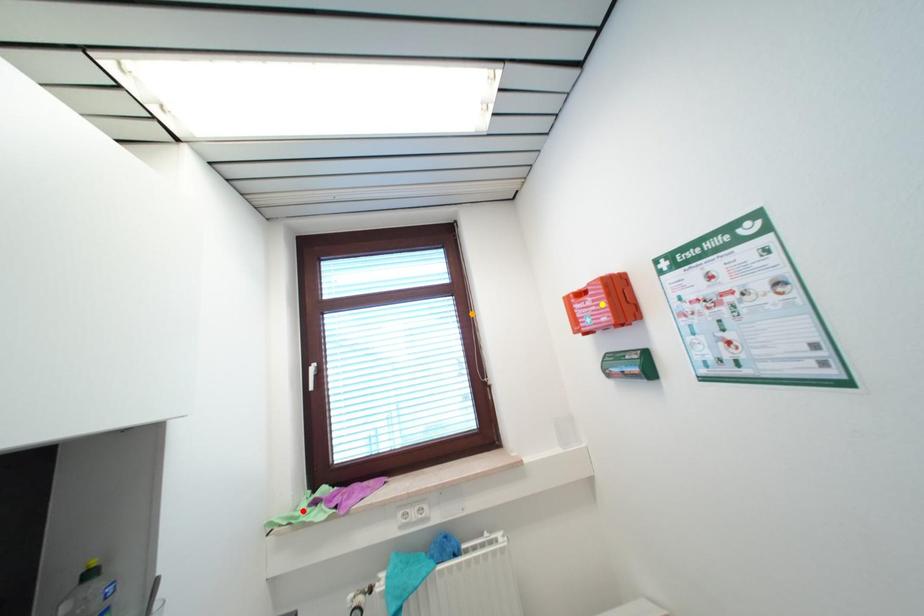
Order these from nearest to farthest:
- orange point
- red point
- yellow point

yellow point, red point, orange point